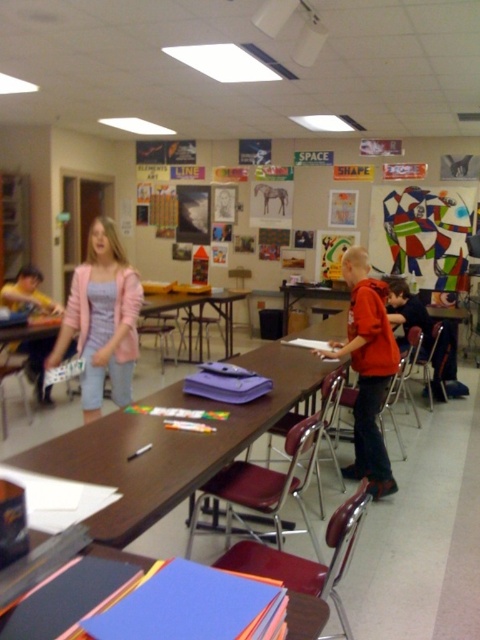
Question: Observing the image, what is the correct spatial positioning of brown wooden table at center in reference to pink fabric jacket at center?

Choices:
 (A) left
 (B) right

Answer: (B)

Question: Is brown wooden table at center to the left of smooth blue paper at center from the viewer's perspective?

Choices:
 (A) no
 (B) yes

Answer: (A)

Question: Which object is the farthest from the smooth blue paper at center?

Choices:
 (A) brown wooden table at center
 (B) orange matte shirt at center
 (C) pink fabric jacket at center

Answer: (B)

Question: Is orange matte shirt at center smaller than smooth blue paper at center?

Choices:
 (A) no
 (B) yes

Answer: (A)

Question: Considering the real-world distances, which object is closest to the smooth blue paper at center?

Choices:
 (A) orange matte shirt at center
 (B) brown wooden table at center

Answer: (B)

Question: Which point is farther to the camera?

Choices:
 (A) smooth blue paper at center
 (B) brown wooden table at center
 (C) orange matte shirt at center
 (D) pink fabric jacket at center

Answer: (C)